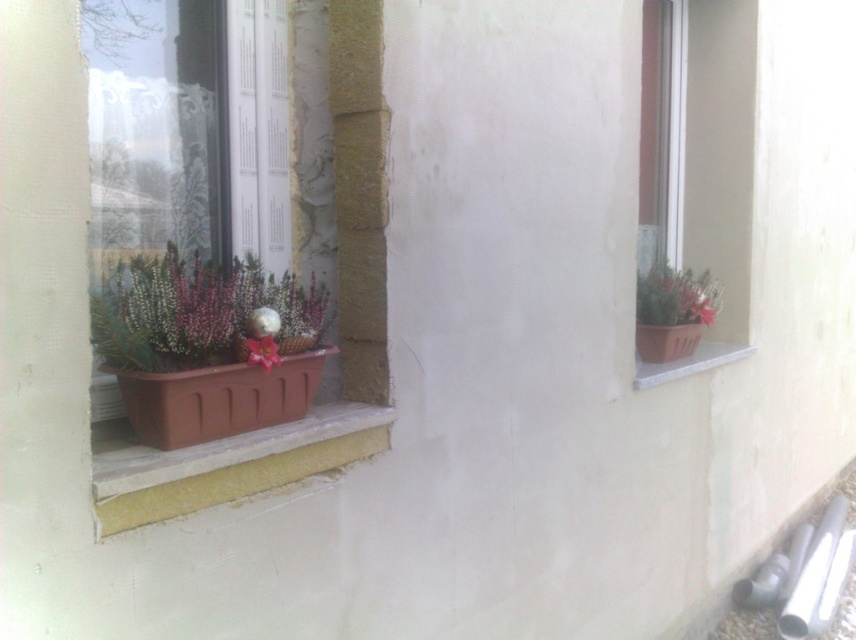
You are standing 1.5 meters away from the camera. Can you reach the point at coordinates point (268, 378)?

The point at coordinates point (268, 378) is 1.58 meters away from the camera. Since you are standing 1.5 meters away from the camera, you are 0.08 meters closer to the point than the camera. Therefore, you can reach the point at coordinates point (268, 378).

You are a window cleaner with a 1.5 meter long ladder. You need to clean both the brown plastic flower box at left and the pink matte flower at lower center. Given their widths, which object will require you to extend the ladder further to reach its full width?

The brown plastic flower box at left is wider than the pink matte flower at lower center, so you will need to extend the ladder further to reach its full width.

You are a gardener who wants to place a new plant in one of the pots. The new plant requires a larger container to grow properly. Which pot should you choose between the matte plastic pot at left and the brown plastic at right?

The brown plastic at right is larger in size compared to the matte plastic pot at left, so you should choose the brown plastic at right for the new plant that requires a larger container.